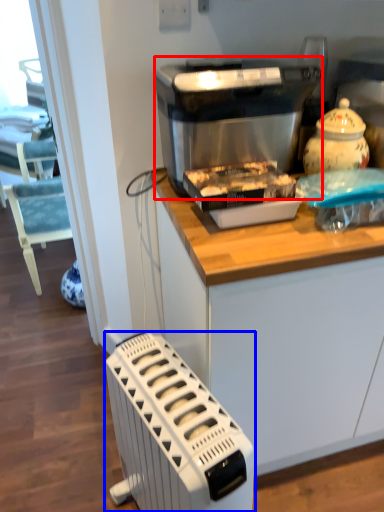
Question: Which of the following is the closest to the observer, kitchen appliance (highlighted by a red box) or home appliance (highlighted by a blue box)?

Choices:
 (A) kitchen appliance
 (B) home appliance

Answer: (B)